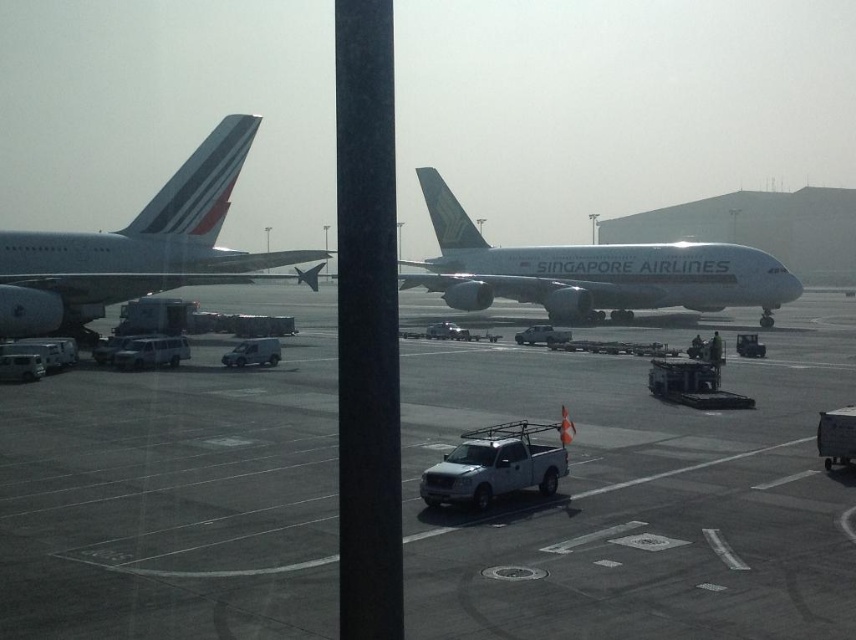
You are a ground crew member who needs to check the distance between the two white glossy airplanes. According to the image, how far apart are the white glossy airplane at left and the white glossy airplane at center?

The white glossy airplane at left is 19.59 meters away from the white glossy airplane at center.

You are a pilot preparing to taxi your plane to the runway. You notice the gray asphalt tarmac at center and the white glossy airplane at left. Which surface should you prioritize staying on to ensure proper navigation?

You should prioritize staying on the gray asphalt tarmac at center because it is in front of the white glossy airplane at left, indicating it is the designated path for vehicles and aircraft movement.